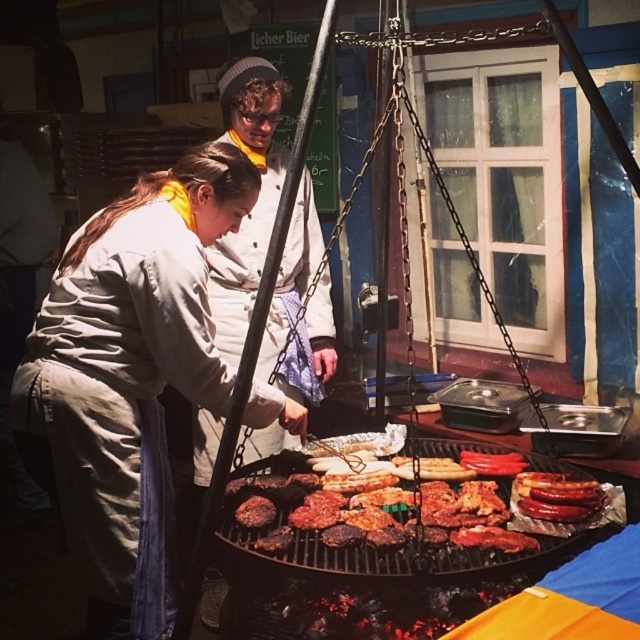
Which is below, matte white apron at center or charred meat at center?

Positioned lower is charred meat at center.

Does matte white apron at center appear over charred meat at center?

Indeed, matte white apron at center is positioned over charred meat at center.

The width and height of the screenshot is (640, 640). I want to click on matte white apron at center, so click(x=129, y=378).

This screenshot has height=640, width=640. What are the coordinates of `matte white apron at center` in the screenshot? It's located at (129, 378).